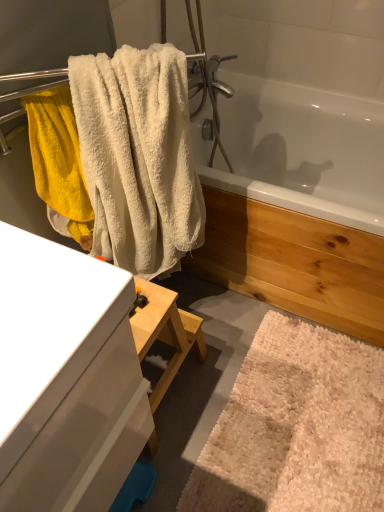
Question: Is white glossy bathtub at upper center thinner than white fluffy bath mat at lower right?

Choices:
 (A) no
 (B) yes

Answer: (A)

Question: Does white glossy bathtub at upper center have a lesser height compared to white fluffy bath mat at lower right?

Choices:
 (A) no
 (B) yes

Answer: (A)

Question: From the image's perspective, would you say white glossy bathtub at upper center is shown under white fluffy bath mat at lower right?

Choices:
 (A) no
 (B) yes

Answer: (A)

Question: Does white glossy bathtub at upper center have a smaller size compared to white fluffy bath mat at lower right?

Choices:
 (A) yes
 (B) no

Answer: (B)

Question: Does white glossy bathtub at upper center appear on the left side of white fluffy bath mat at lower right?

Choices:
 (A) no
 (B) yes

Answer: (A)

Question: Could you tell me if white glossy bathtub at upper center is turned towards white fluffy bath mat at lower right?

Choices:
 (A) no
 (B) yes

Answer: (B)

Question: From the image's perspective, is white glossy cabinet at left below white fluffy bath mat at lower right?

Choices:
 (A) yes
 (B) no

Answer: (B)

Question: Considering the relative positions of white glossy cabinet at left and white fluffy bath mat at lower right in the image provided, is white glossy cabinet at left to the left of white fluffy bath mat at lower right from the viewer's perspective?

Choices:
 (A) yes
 (B) no

Answer: (A)

Question: Is white glossy cabinet at left looking in the opposite direction of white fluffy bath mat at lower right?

Choices:
 (A) yes
 (B) no

Answer: (B)

Question: Is white glossy cabinet at left to the right of white fluffy bath mat at lower right from the viewer's perspective?

Choices:
 (A) yes
 (B) no

Answer: (B)

Question: From a real-world perspective, is white glossy cabinet at left on top of white fluffy bath mat at lower right?

Choices:
 (A) no
 (B) yes

Answer: (B)

Question: Is white glossy cabinet at left completely or partially outside of white fluffy bath mat at lower right?

Choices:
 (A) yes
 (B) no

Answer: (A)

Question: Considering the relative positions of white fluffy bath mat at lower right and white fluffy towel at upper left in the image provided, is white fluffy bath mat at lower right behind white fluffy towel at upper left?

Choices:
 (A) no
 (B) yes

Answer: (B)